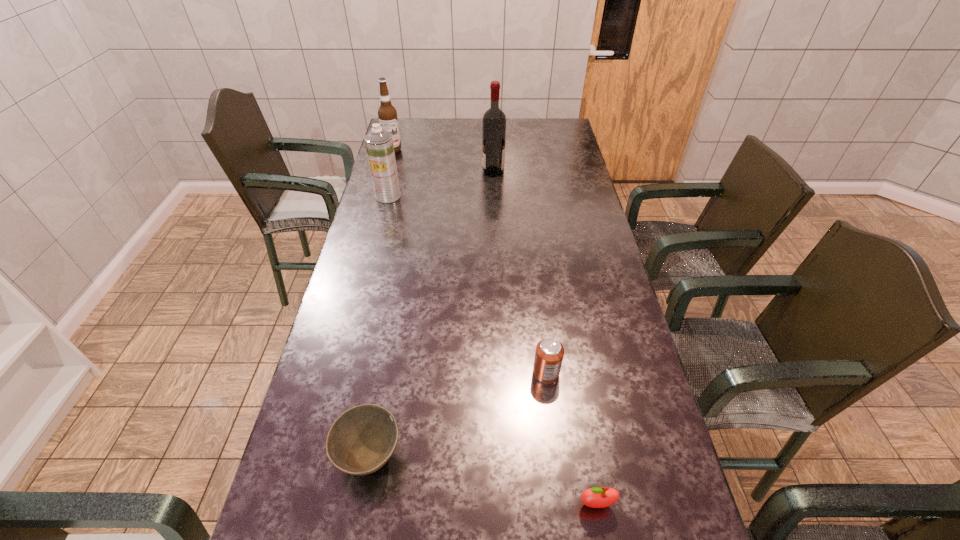
Locate an element on the screen. This screenshot has width=960, height=540. free spot between the bowl and the shorter alcohol is located at coordinates (381, 303).

What are the coordinates of `free spot between the third nearest object and the bowl` in the screenshot? It's located at (458, 415).

Image resolution: width=960 pixels, height=540 pixels. What are the coordinates of `the third closest object to the aerosol can` in the screenshot? It's located at (549, 353).

Select which object appears as the fifth closest to the bowl. Please provide its 2D coordinates. Your answer should be formatted as a tuple, i.e. [(x, y)], where the tuple contains the x and y coordinates of a point satisfying the conditions above.

[(387, 114)]

The image size is (960, 540). In order to click on free space that satisfies the following two spatial constraints: 1. on the label of the apple; 2. on the left side of the farthest object in this screenshot , I will do `click(295, 504)`.

Identify the location of vacant point that satisfies the following two spatial constraints: 1. on the front and back of the right alcohol; 2. on the right side of the nearest object. The width and height of the screenshot is (960, 540). (506, 504).

Where is `free space that satisfies the following two spatial constraints: 1. on the front and back of the right alcohol; 2. on the right side of the can`? free space that satisfies the following two spatial constraints: 1. on the front and back of the right alcohol; 2. on the right side of the can is located at coordinates (501, 373).

What are the coordinates of `vacant space that satisfies the following two spatial constraints: 1. on the label of the nearest object; 2. on the right side of the shorter alcohol` in the screenshot? It's located at (295, 504).

Find the location of a particular element. The height and width of the screenshot is (540, 960). vacant position in the image that satisfies the following two spatial constraints: 1. on the label of the left alcohol; 2. on the left side of the fourth farthest object is located at coordinates (331, 373).

Find the location of a particular element. This screenshot has height=540, width=960. vacant region that satisfies the following two spatial constraints: 1. on the label of the left alcohol; 2. on the left side of the apple is located at coordinates (295, 504).